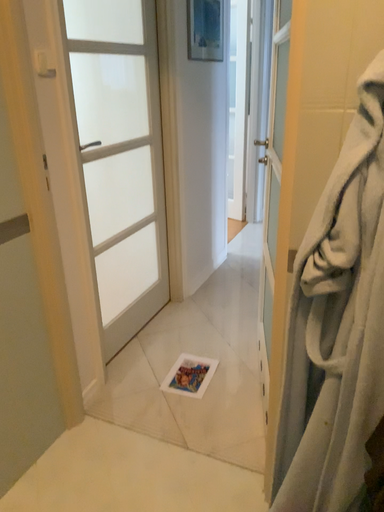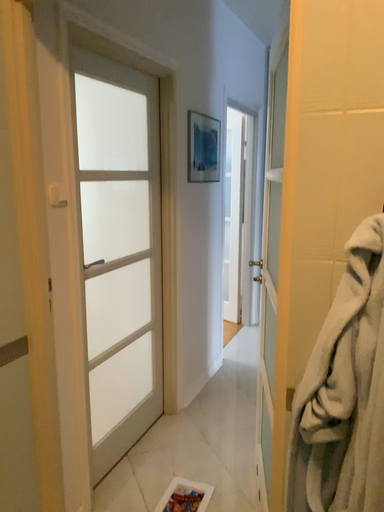
Question: Which way did the camera rotate in the video?

Choices:
 (A) rotated downward
 (B) rotated upward

Answer: (B)